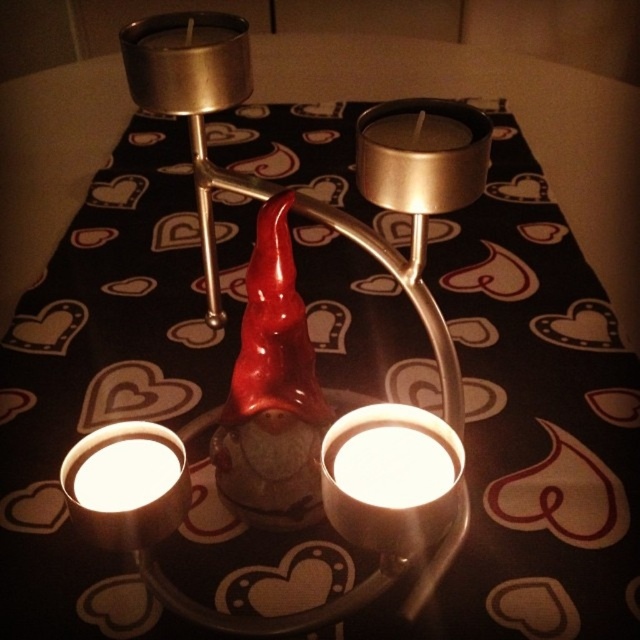
Question: From the image, what is the correct spatial relationship of white matte candle at lower left in relation to brushed metal candle at upper center?

Choices:
 (A) above
 (B) below

Answer: (B)

Question: Which point is farther to the camera?

Choices:
 (A) (164, 531)
 (B) (419, 547)

Answer: (A)

Question: Does brushed metal candle holder at center have a larger size compared to matte silver candle at upper center?

Choices:
 (A) no
 (B) yes

Answer: (B)

Question: Is brushed metal candle holder at center smaller than brushed metal candle at upper center?

Choices:
 (A) yes
 (B) no

Answer: (A)

Question: Which point is closer to the camera?

Choices:
 (A) (419, 451)
 (B) (182, 44)

Answer: (A)

Question: Which of the following is the closest to the observer?

Choices:
 (A) brushed metal candle holder at center
 (B) white matte candle at lower left
 (C) matte silver candle at upper center
 (D) brushed metal candle at upper center

Answer: (C)